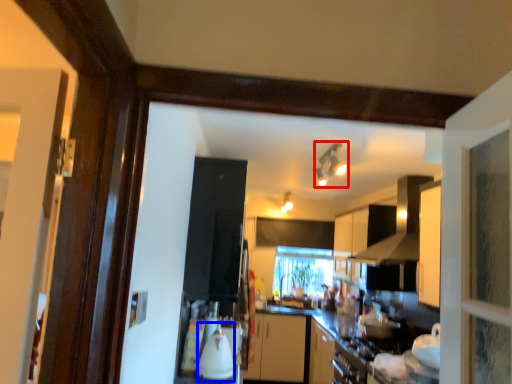
Question: Among these objects, which one is nearest to the camera, light fixture (highlighted by a red box) or appliance (highlighted by a blue box)?

Choices:
 (A) light fixture
 (B) appliance

Answer: (B)